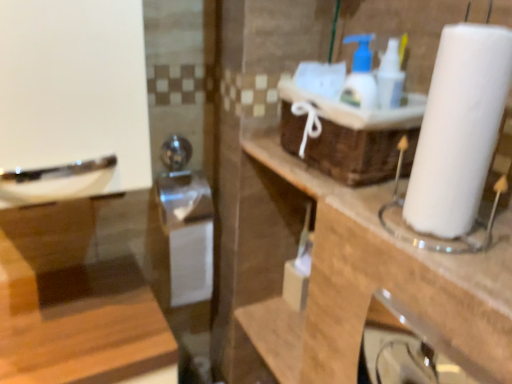
The image size is (512, 384). I want to click on empty space that is ontop of brown woven basket at upper center (from a real-world perspective), so click(x=336, y=91).